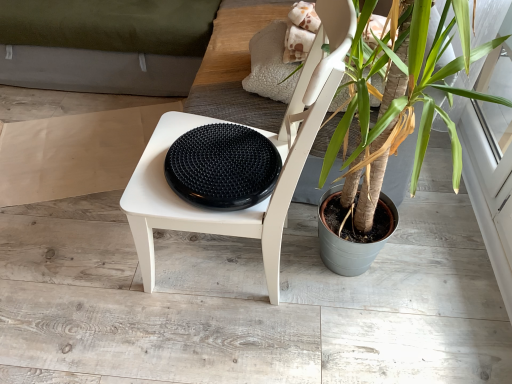
Question: Is white matte chair at center at the right side of black rubber disc at center?

Choices:
 (A) no
 (B) yes

Answer: (B)

Question: From the image's perspective, does white matte chair at center appear lower than black rubber disc at center?

Choices:
 (A) yes
 (B) no

Answer: (A)

Question: Is white matte chair at center not near black rubber disc at center?

Choices:
 (A) no
 (B) yes

Answer: (A)

Question: Is white matte chair at center taller than black rubber disc at center?

Choices:
 (A) no
 (B) yes

Answer: (B)

Question: Does white matte chair at center have a lesser height compared to black rubber disc at center?

Choices:
 (A) yes
 (B) no

Answer: (B)

Question: Is white matte chair at center situated inside beige paper at left or outside?

Choices:
 (A) inside
 (B) outside

Answer: (B)

Question: Considering the positions of white matte chair at center and beige paper at left in the image, is white matte chair at center wider or thinner than beige paper at left?

Choices:
 (A) thin
 (B) wide

Answer: (A)

Question: From the image's perspective, relative to beige paper at left, is white matte chair at center above or below?

Choices:
 (A) below
 (B) above

Answer: (A)

Question: Is point (134, 210) positioned closer to the camera than point (58, 145)?

Choices:
 (A) farther
 (B) closer

Answer: (B)

Question: Choose the correct answer: Is black rubber disc at center inside beige paper at left or outside it?

Choices:
 (A) inside
 (B) outside

Answer: (B)

Question: Considering the positions of black rubber disc at center and beige paper at left in the image, is black rubber disc at center taller or shorter than beige paper at left?

Choices:
 (A) tall
 (B) short

Answer: (A)

Question: From the image's perspective, relative to beige paper at left, is black rubber disc at center above or below?

Choices:
 (A) below
 (B) above

Answer: (A)

Question: In the image, is black rubber disc at center positioned in front of or behind beige paper at left?

Choices:
 (A) front
 (B) behind

Answer: (A)

Question: In the image, is beige paper at left positioned in front of or behind white matte chair at center?

Choices:
 (A) front
 (B) behind

Answer: (B)

Question: From the image's perspective, is beige paper at left above or below white matte chair at center?

Choices:
 (A) below
 (B) above

Answer: (B)